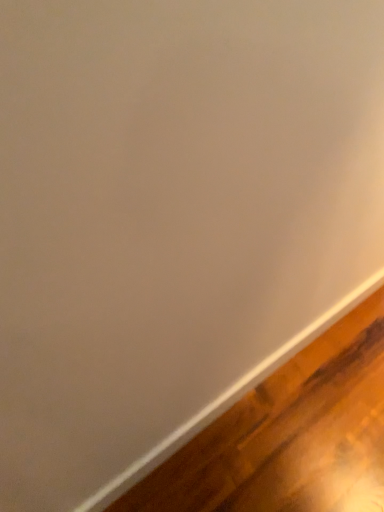
What do you see at coordinates (276, 428) in the screenshot? I see `wooden floor at bottom right` at bounding box center [276, 428].

Find the location of a particular element. Image resolution: width=384 pixels, height=512 pixels. wooden floor at bottom right is located at coordinates (276, 428).

Where is `wooden floor at bottom right`? wooden floor at bottom right is located at coordinates (276, 428).